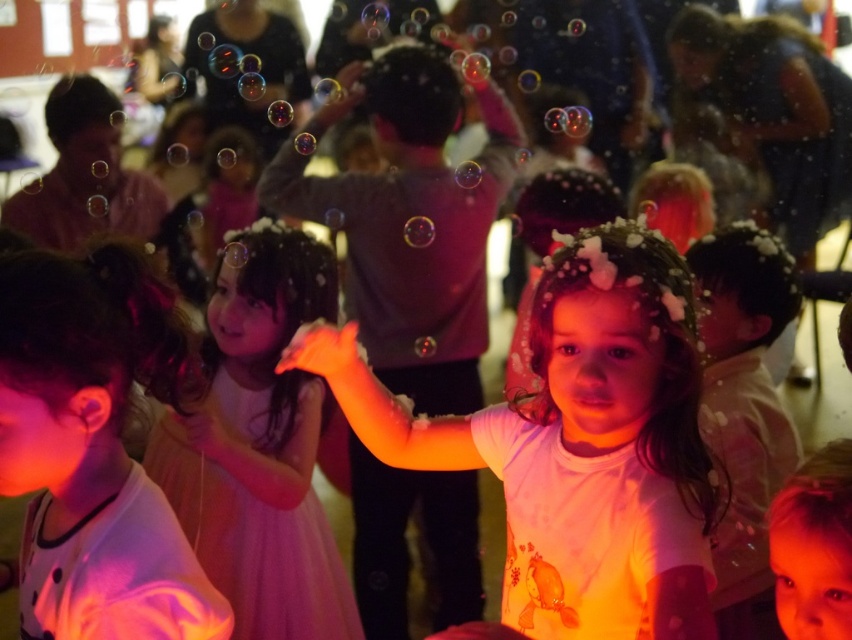
You are a photographer trying to capture a shot of the matte white dress at center and the transparent soap bubble at center. Since both are at the center, which one is positioned more to the left?

The matte white dress at center is to the left of the transparent soap bubble at center, so it is positioned more to the left.

You are a photographer trying to focus on two points in the image. The first point is at coordinate point(283, 506) and the second is at point(717, 580). Which point is closer to your camera?

The point at coordinate point(283, 506) is closer to the camera than the point at point(717, 580).

You are organizing a clothing display and need to arrange the matte white shirt at center and the pink satin dress at center side by side. Based on their widths, which clothing item should be placed on the left to ensure they fit within a 1.5 meter wide display stand?

The matte white shirt at center should be placed on the left since it is wider than the pink satin dress at center, ensuring both items fit within the 1.5 meter wide display stand.